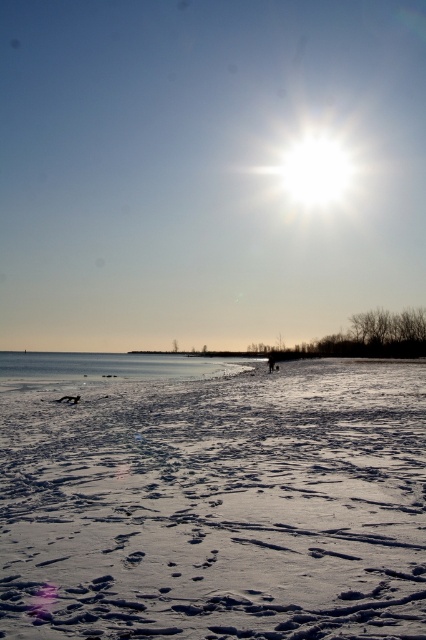
Is point (135, 426) positioned after point (37, 369)?

No.

In the scene shown: Is white powdery snow at center positioned before clear ice lake at center?

Yes, white powdery snow at center is in front of clear ice lake at center.

Locate an element on the screen. The image size is (426, 640). white powdery snow at center is located at coordinates (212, 499).